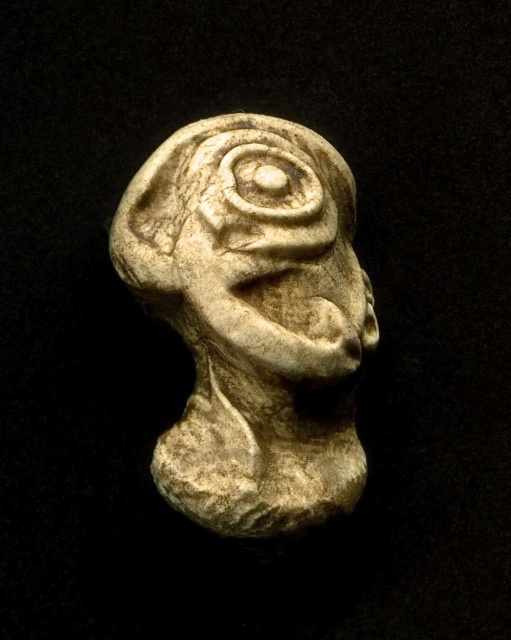
How much distance is there between white stone head at center and white stone face at center?

white stone head at center is 1.11 inches away from white stone face at center.

Can you confirm if white stone head at center is positioned to the left of white stone face at center?

Correct, you'll find white stone head at center to the left of white stone face at center.

What do you see at coordinates (253, 317) in the screenshot?
I see `white stone head at center` at bounding box center [253, 317].

Where is `white stone head at center`? Image resolution: width=511 pixels, height=640 pixels. white stone head at center is located at coordinates (253, 317).